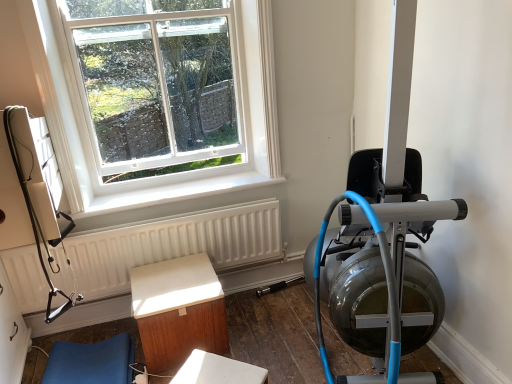
Question: Is white glass window at upper left wider or thinner than blue rubber rowing machine at right?

Choices:
 (A) thin
 (B) wide

Answer: (A)

Question: Is white glass window at upper left situated inside blue rubber rowing machine at right or outside?

Choices:
 (A) outside
 (B) inside

Answer: (A)

Question: Which of these objects is positioned farthest from the white glass window at upper left?

Choices:
 (A) white matte table at lower center
 (B) blue fabric cushion at lower left, the 2th furniture from the right
 (C) light brown wood table at center, the first furniture when ordered from right to left
 (D) white matte radiator at lower center
 (E) blue rubber rowing machine at right

Answer: (A)

Question: Based on their relative distances, which object is nearer to the white matte radiator at lower center?

Choices:
 (A) white glass window at upper left
 (B) blue rubber rowing machine at right
 (C) white matte table at lower center
 (D) light brown wood table at center, acting as the 2th furniture starting from the left
 (E) blue fabric cushion at lower left, placed as the first furniture when sorted from left to right

Answer: (D)